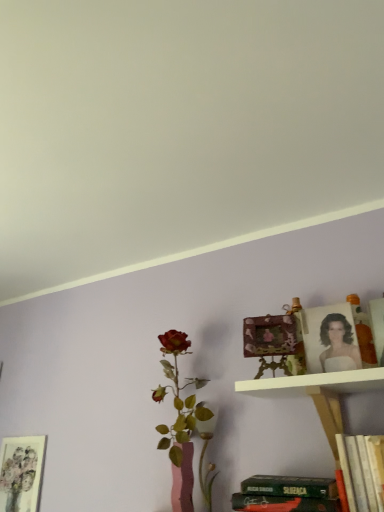
What do you see at coordinates (330, 339) in the screenshot?
I see `matte gold picture frame at upper right, the 1th picture frame when ordered from front to back` at bounding box center [330, 339].

You are a GUI agent. You are given a task and a screenshot of the screen. Output one action in this format:
    pyautogui.click(x=<x>, y=<y>)
    Task: Click on the white wooden shelf at upper center
    Image resolution: width=384 pixels, height=512 pixels.
    Given the screenshot: What is the action you would take?
    pyautogui.click(x=320, y=393)

Find the location of `matte floral print at lower left, positioned as the first picture frame in bottom-to-top order`. matte floral print at lower left, positioned as the first picture frame in bottom-to-top order is located at coordinates (21, 473).

Who is shorter, wooden carved frame at upper right, which is the 2th picture frame in back-to-front order, or matte floral print at lower left, placed as the 3th picture frame when sorted from right to left?

wooden carved frame at upper right, which is the 2th picture frame in back-to-front order.

Considering the relative sizes of wooden carved frame at upper right, which is the 2th picture frame from front to back, and matte floral print at lower left, which is counted as the third picture frame, starting from the front, in the image provided, is wooden carved frame at upper right, which is the 2th picture frame from front to back, smaller than matte floral print at lower left, which is counted as the third picture frame, starting from the front,?

Actually, wooden carved frame at upper right, which is the 2th picture frame from front to back, might be larger than matte floral print at lower left, which is counted as the third picture frame, starting from the front.

Is wooden carved frame at upper right, arranged as the 2th picture frame when ordered from the bottom, beside matte floral print at lower left, arranged as the 3th picture frame when viewed from the top?

wooden carved frame at upper right, arranged as the 2th picture frame when ordered from the bottom, and matte floral print at lower left, arranged as the 3th picture frame when viewed from the top, are clearly separated.

Which is behind, wooden carved frame at upper right, arranged as the 2th picture frame when ordered from the bottom, or matte floral print at lower left, which is counted as the third picture frame, starting from the front?

matte floral print at lower left, which is counted as the third picture frame, starting from the front, is further away from the camera.

Considering the positions of objects matte gold picture frame at upper right, arranged as the first picture frame when viewed from the top, and matte floral print at lower left, the first picture frame from the back, in the image provided, who is more to the left, matte gold picture frame at upper right, arranged as the first picture frame when viewed from the top, or matte floral print at lower left, the first picture frame from the back,?

From the viewer's perspective, matte floral print at lower left, the first picture frame from the back, appears more on the left side.

Could matte floral print at lower left, which is counted as the 1th picture frame, starting from the left, be considered to be inside matte gold picture frame at upper right, placed as the third picture frame when sorted from back to front?

No, matte floral print at lower left, which is counted as the 1th picture frame, starting from the left, is not inside matte gold picture frame at upper right, placed as the third picture frame when sorted from back to front.

Is matte gold picture frame at upper right, the 1th picture frame in the right-to-left sequence, shorter than matte floral print at lower left, the first picture frame from the back?

Yes, matte gold picture frame at upper right, the 1th picture frame in the right-to-left sequence, is shorter than matte floral print at lower left, the first picture frame from the back.

Is matte gold picture frame at upper right, positioned as the 3th picture frame in left-to-right order, positioned with its back to wooden carved frame at upper right, which is the 2th picture frame from front to back?

No, matte gold picture frame at upper right, positioned as the 3th picture frame in left-to-right order,'s orientation is not away from wooden carved frame at upper right, which is the 2th picture frame from front to back.

Which point is more forward, (313, 321) or (286, 346)?

Positioned in front is point (286, 346).

Which object is positioned more to the left, matte gold picture frame at upper right, the 1th picture frame when ordered from front to back, or wooden carved frame at upper right, which is the 2th picture frame from front to back?

Positioned to the left is wooden carved frame at upper right, which is the 2th picture frame from front to back.

Looking at their sizes, would you say wooden carved frame at upper right, which is the second picture frame in left-to-right order, is wider or thinner than matte gold picture frame at upper right, positioned as the 3th picture frame in left-to-right order?

Considering their sizes, wooden carved frame at upper right, which is the second picture frame in left-to-right order, looks broader than matte gold picture frame at upper right, positioned as the 3th picture frame in left-to-right order.

Is matte gold picture frame at upper right, the third picture frame in the bottom-to-top sequence, inside wooden carved frame at upper right, which is the 2th picture frame from front to back?

No, matte gold picture frame at upper right, the third picture frame in the bottom-to-top sequence, is not a part of wooden carved frame at upper right, which is the 2th picture frame from front to back.

Which point is more distant from viewer, (x=281, y=351) or (x=323, y=360)?

The point (x=281, y=351) is behind.

In terms of size, does white matte wall at upper center appear bigger or smaller than white wooden shelf at upper center?

white matte wall at upper center is bigger than white wooden shelf at upper center.

Considering the sizes of objects white matte wall at upper center and white wooden shelf at upper center in the image provided, who is thinner, white matte wall at upper center or white wooden shelf at upper center?

With smaller width is white wooden shelf at upper center.

Is matte floral print at lower left, which is counted as the third picture frame, starting from the front, not close to wooden carved frame at upper right, which is the 2th picture frame in back-to-front order?

Absolutely, matte floral print at lower left, which is counted as the third picture frame, starting from the front, is distant from wooden carved frame at upper right, which is the 2th picture frame in back-to-front order.

Locate an element on the screen. picture frame that is the 2nd object above the matte floral print at lower left, placed as the 3th picture frame when sorted from right to left (from a real-world perspective) is located at coordinates [269, 335].

How different are the orientations of matte floral print at lower left, positioned as the first picture frame in bottom-to-top order, and wooden carved frame at upper right, arranged as the 2th picture frame when ordered from the bottom, in degrees?

The angular difference between matte floral print at lower left, positioned as the first picture frame in bottom-to-top order, and wooden carved frame at upper right, arranged as the 2th picture frame when ordered from the bottom, is 17.5 degrees.

Does matte floral print at lower left, which is counted as the 1th picture frame, starting from the left, contain white wooden shelf at upper center?

That's incorrect, white wooden shelf at upper center is not inside matte floral print at lower left, which is counted as the 1th picture frame, starting from the left.

Would you say matte floral print at lower left, the first picture frame from the back, is to the left or to the right of white wooden shelf at upper center in the picture?

From the image, it's evident that matte floral print at lower left, the first picture frame from the back, is to the left of white wooden shelf at upper center.

From a real-world perspective, relative to white wooden shelf at upper center, is matte floral print at lower left, placed as the 3th picture frame when sorted from right to left, vertically above or below?

matte floral print at lower left, placed as the 3th picture frame when sorted from right to left, is situated lower than white wooden shelf at upper center in the real world.

From the image's perspective, which one is positioned higher, matte floral print at lower left, the first picture frame from the back, or white wooden shelf at upper center?

white wooden shelf at upper center appears higher in the image.

I want to click on picture frame behind the wooden carved frame at upper right, arranged as the 2th picture frame when ordered from the bottom, so click(21, 473).

Locate an element on the screen. The width and height of the screenshot is (384, 512). the 2nd picture frame in front of the matte floral print at lower left, placed as the 3th picture frame when sorted from right to left is located at coordinates (330, 339).

Estimate the real-world distances between objects in this image. Which object is further from matte floral print at lower left, which is counted as the third picture frame, starting from the front, white matte wall at upper center or matte gold picture frame at upper right, the 1th picture frame in the right-to-left sequence?

The object further to matte floral print at lower left, which is counted as the third picture frame, starting from the front, is matte gold picture frame at upper right, the 1th picture frame in the right-to-left sequence.

Which object lies further to the anchor point wooden carved frame at upper right, which is the 2th picture frame in back-to-front order, matte gold picture frame at upper right, placed as the third picture frame when sorted from back to front, or white wooden shelf at upper center?

Based on the image, white wooden shelf at upper center appears to be further to wooden carved frame at upper right, which is the 2th picture frame in back-to-front order.

Based on their spatial positions, is matte gold picture frame at upper right, the 1th picture frame when ordered from front to back, or matte floral print at lower left, the first picture frame from the back, closer to white matte wall at upper center?

matte gold picture frame at upper right, the 1th picture frame when ordered from front to back, is closer to white matte wall at upper center.

When comparing their distances from matte floral print at lower left, positioned as the first picture frame in bottom-to-top order, does white wooden shelf at upper center or matte gold picture frame at upper right, the 1th picture frame when ordered from front to back, seem further?

Based on the image, matte gold picture frame at upper right, the 1th picture frame when ordered from front to back, appears to be further to matte floral print at lower left, positioned as the first picture frame in bottom-to-top order.

Based on their spatial positions, is white matte wall at upper center or matte floral print at lower left, the first picture frame from the back, closer to wooden carved frame at upper right, which is the 2th picture frame in back-to-front order?

The object closer to wooden carved frame at upper right, which is the 2th picture frame in back-to-front order, is white matte wall at upper center.

When comparing their distances from wooden carved frame at upper right, arranged as the 2th picture frame when ordered from the bottom, does matte floral print at lower left, arranged as the 3th picture frame when viewed from the top, or matte gold picture frame at upper right, the third picture frame in the bottom-to-top sequence, seem closer?

matte gold picture frame at upper right, the third picture frame in the bottom-to-top sequence, lies closer to wooden carved frame at upper right, arranged as the 2th picture frame when ordered from the bottom, than the other object.

Looking at the image, which one is located further to white wooden shelf at upper center, matte floral print at lower left, placed as the 3th picture frame when sorted from right to left, or matte gold picture frame at upper right, the 1th picture frame in the right-to-left sequence?

matte floral print at lower left, placed as the 3th picture frame when sorted from right to left.

When comparing their distances from matte floral print at lower left, the first picture frame from the back, does white wooden shelf at upper center or white matte wall at upper center seem further?

white matte wall at upper center.

Where is `picture frame between white matte wall at upper center and matte gold picture frame at upper right, positioned as the 3th picture frame in left-to-right order, from left to right`? The height and width of the screenshot is (512, 384). picture frame between white matte wall at upper center and matte gold picture frame at upper right, positioned as the 3th picture frame in left-to-right order, from left to right is located at coordinates (269, 335).

I want to click on picture frame located between white wooden shelf at upper center and wooden carved frame at upper right, which is the 2th picture frame in back-to-front order, in the depth direction, so click(x=330, y=339).

Where is `shelf between matte floral print at lower left, which is counted as the 1th picture frame, starting from the left, and matte gold picture frame at upper right, the 1th picture frame when ordered from front to back, in the horizontal direction`? shelf between matte floral print at lower left, which is counted as the 1th picture frame, starting from the left, and matte gold picture frame at upper right, the 1th picture frame when ordered from front to back, in the horizontal direction is located at coordinates (320, 393).

Locate an element on the screen. The image size is (384, 512). shelf between white matte wall at upper center and matte gold picture frame at upper right, placed as the third picture frame when sorted from back to front, from left to right is located at coordinates (320, 393).